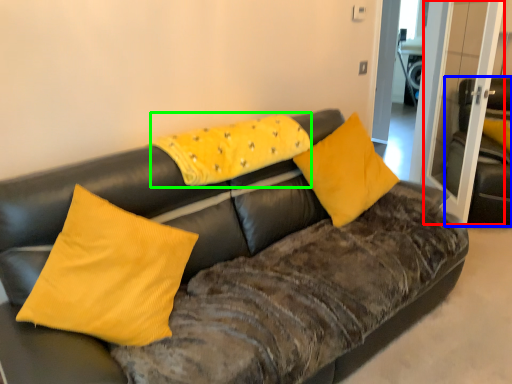
Question: Based on their relative distances, which object is nearer to glass door (highlighted by a red box)? Choose from armchair (highlighted by a blue box) and pillow (highlighted by a green box).

Choices:
 (A) armchair
 (B) pillow

Answer: (A)